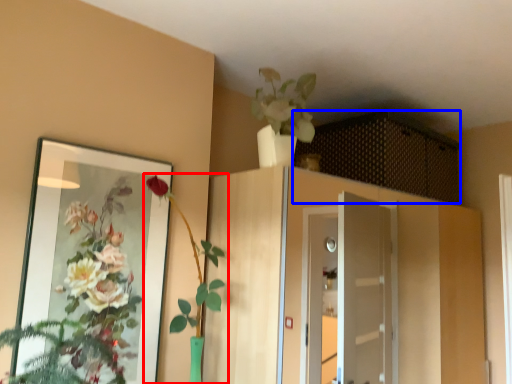
Question: Which of the following is the closest to the observer, houseplant (highlighted by a red box) or cabinetry (highlighted by a blue box)?

Choices:
 (A) houseplant
 (B) cabinetry

Answer: (A)